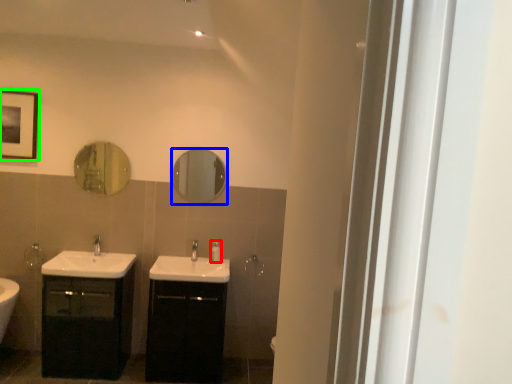
Question: Which object is the farthest from toiletry (highlighted by a red box)? Choose among these: mirror (highlighted by a blue box) or picture frame (highlighted by a green box).

Choices:
 (A) mirror
 (B) picture frame

Answer: (B)